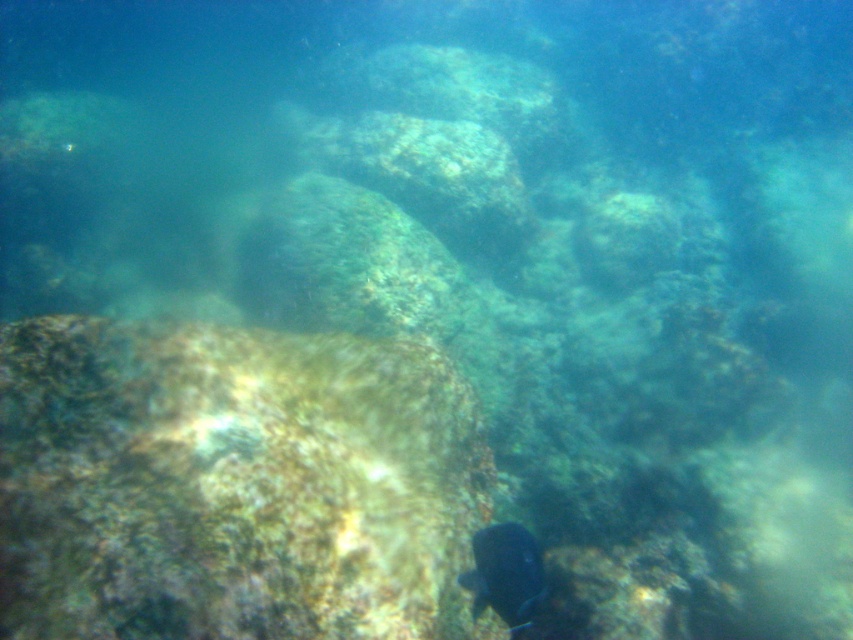
Question: Among these points, which one is farthest from the camera?

Choices:
 (A) (508, 540)
 (B) (308, 627)

Answer: (A)

Question: Among these points, which one is nearest to the camera?

Choices:
 (A) (460, 422)
 (B) (520, 582)

Answer: (B)

Question: Is greenish-brown textured rock at center positioned in front of shiny blue fish at bottom right?

Choices:
 (A) no
 (B) yes

Answer: (B)

Question: Is greenish-brown textured rock at center above shiny blue fish at bottom right?

Choices:
 (A) no
 (B) yes

Answer: (B)

Question: Among these objects, which one is farthest from the camera?

Choices:
 (A) greenish-brown textured rock at center
 (B) shiny blue fish at bottom right

Answer: (B)

Question: Is greenish-brown textured rock at center to the right of shiny blue fish at bottom right from the viewer's perspective?

Choices:
 (A) no
 (B) yes

Answer: (A)